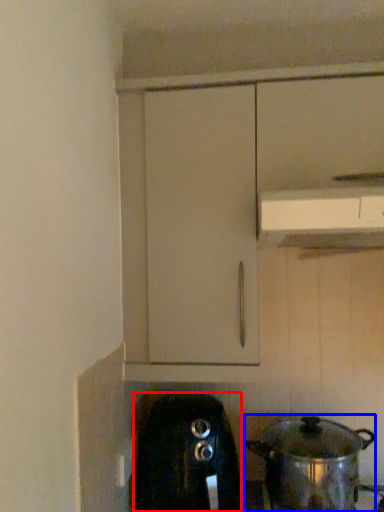
Question: Which object is closer to the camera taking this photo, home appliance (highlighted by a red box) or kitchen appliance (highlighted by a blue box)?

Choices:
 (A) home appliance
 (B) kitchen appliance

Answer: (B)